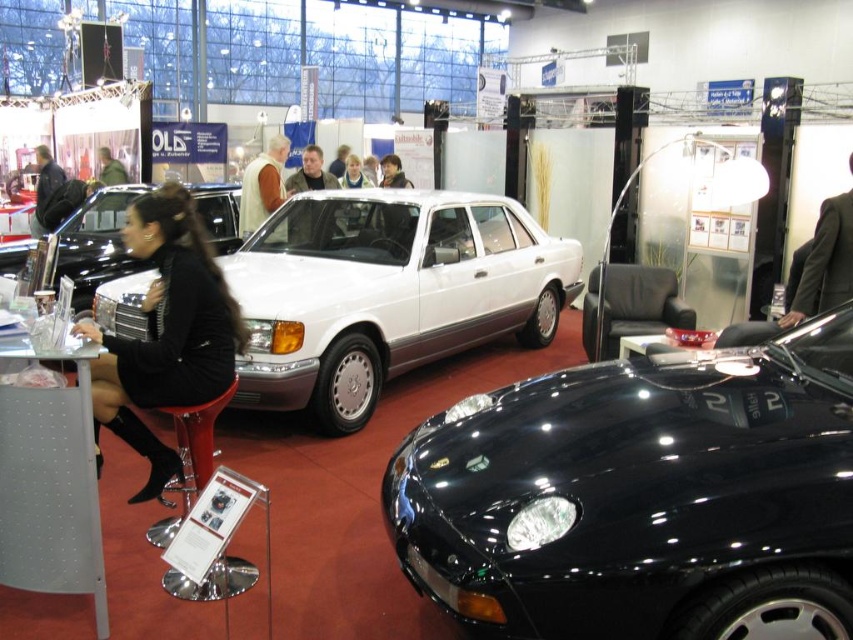
Question: Which point is farther to the camera?

Choices:
 (A) light brown leather jacket at center
 (B) dark gray suit at right
 (C) black fabric dress at lower left

Answer: (A)

Question: Estimate the real-world distances between objects in this image. Which object is farther from the translucent plastic stool at center?

Choices:
 (A) white metallic sedan at center
 (B) glossy black car at lower right

Answer: (A)

Question: Is white metallic sedan at center positioned before dark gray suit at right?

Choices:
 (A) no
 (B) yes

Answer: (B)

Question: Does white metallic sedan at center come behind black fabric dress at lower left?

Choices:
 (A) yes
 (B) no

Answer: (A)

Question: Is dark gray suit at right smaller than translucent plastic stool at center?

Choices:
 (A) yes
 (B) no

Answer: (A)

Question: Which point is closer to the camera?

Choices:
 (A) (94, 234)
 (B) (848, 241)
 (C) (793, 602)
 (D) (247, 209)

Answer: (C)